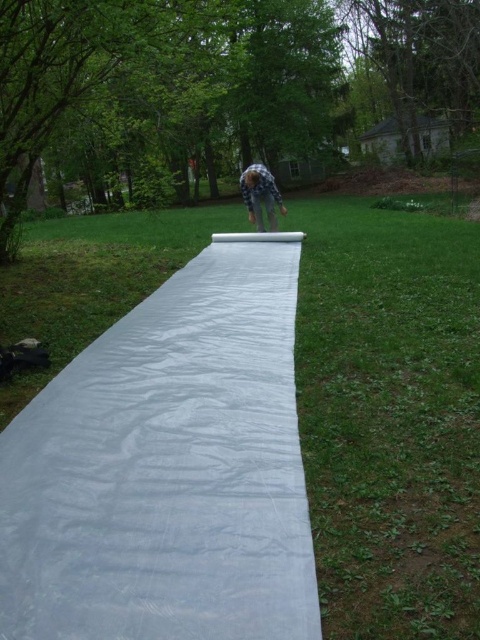
Question: Can you confirm if transparent plastic sheet at center is smaller than blue plaid shirt at center?

Choices:
 (A) no
 (B) yes

Answer: (A)

Question: Which point is farther to the camera?

Choices:
 (A) (230, 253)
 (B) (253, 188)

Answer: (B)

Question: Which point is closer to the camera taking this photo?

Choices:
 (A) (292, 330)
 (B) (267, 212)

Answer: (A)

Question: Is transparent plastic sheet at center further to the viewer compared to blue plaid shirt at center?

Choices:
 (A) yes
 (B) no

Answer: (B)

Question: Does transparent plastic sheet at center have a greater width compared to blue plaid shirt at center?

Choices:
 (A) no
 (B) yes

Answer: (B)